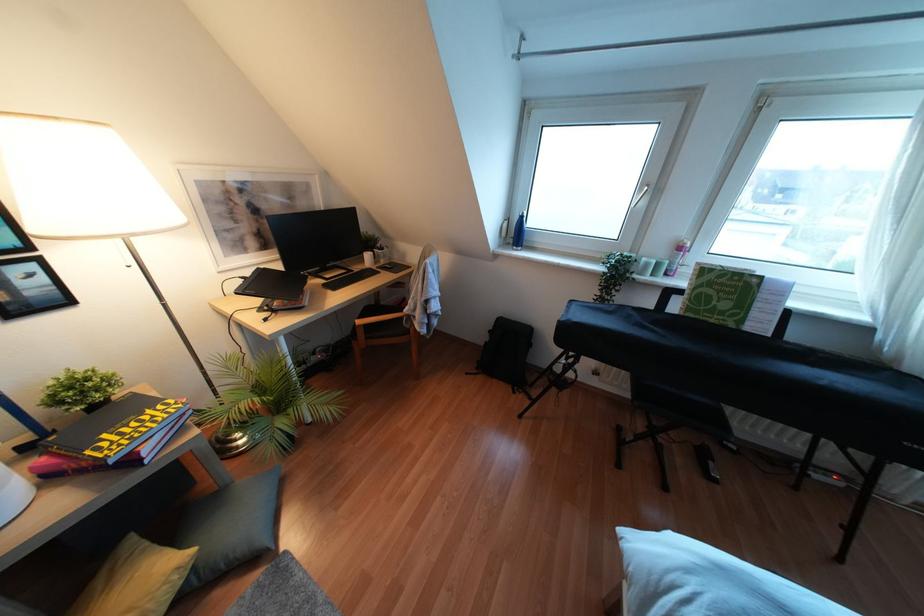
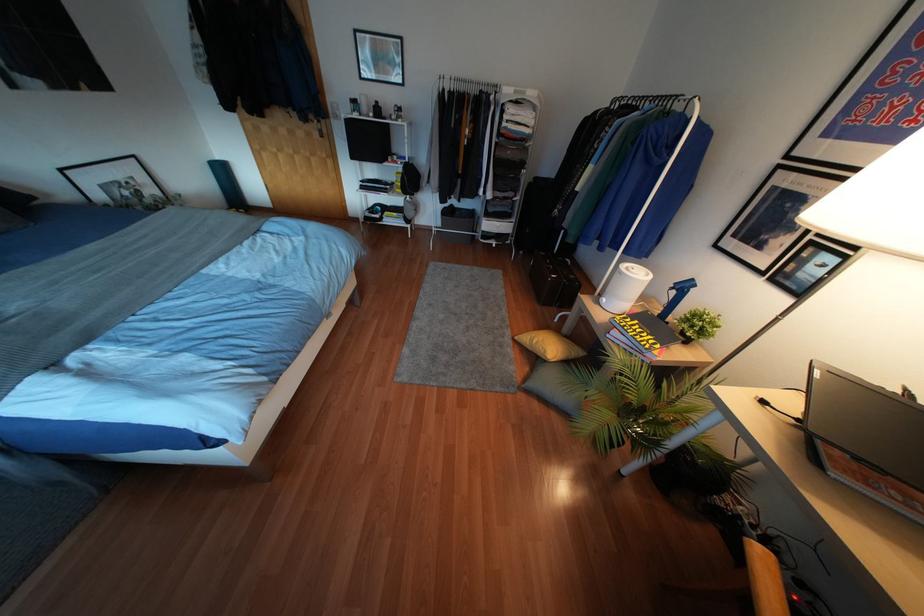
In the second image, find the point that corresponds to the point at 103,435 in the first image.

(637, 321)